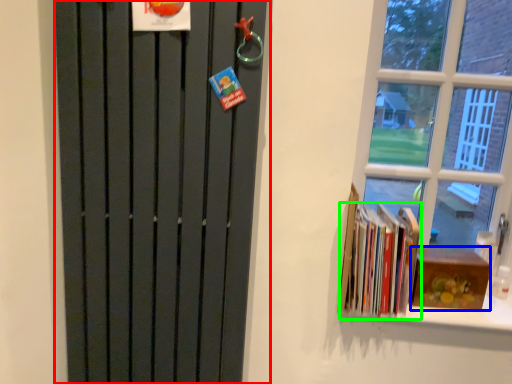
Question: Which object is positioned closest to door (highlighted by a red box)? Select from paperback book (highlighted by a blue box) and book (highlighted by a green box).

Choices:
 (A) paperback book
 (B) book

Answer: (B)